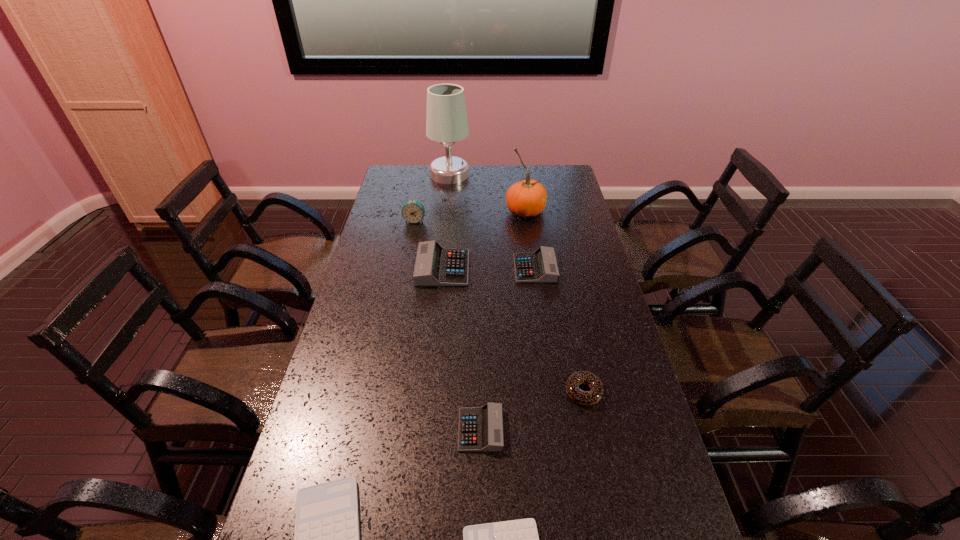
The image size is (960, 540). In order to click on white calculator that stands as the second closest to the farthest object in this screenshot , I will do `click(517, 539)`.

Choose which white calculator is the second nearest neighbor to the farthest object. Please provide its 2D coordinates. Your answer should be formatted as a tuple, i.e. [(x, y)], where the tuple contains the x and y coordinates of a point satisfying the conditions above.

[(517, 539)]